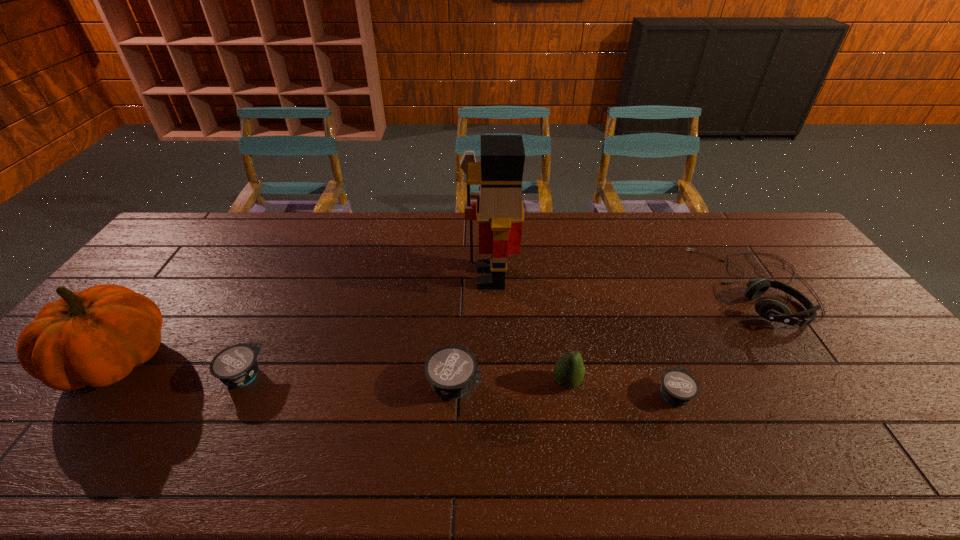
Please point out where to position a new yogurt on the right to maintain spacing. Please provide its 2D coordinates. Your answer should be formatted as a tuple, i.e. [(x, y)], where the tuple contains the x and y coordinates of a point satisfying the conditions above.

[(901, 404)]